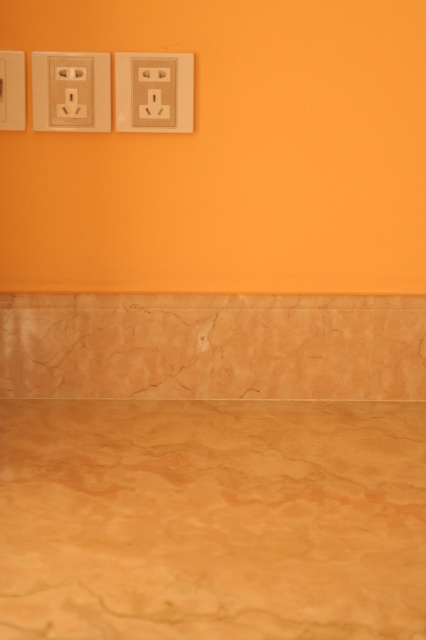
Is beige plastic outlet at upper center bigger than matte beige outlet at upper left?

Yes.

Which is below, beige plastic outlet at upper center or matte beige outlet at upper left?

beige plastic outlet at upper center is below.

Is point (143, 120) closer to viewer compared to point (11, 51)?

No, (143, 120) is further to viewer.

Find the location of a particular element. The image size is (426, 640). beige plastic outlet at upper center is located at coordinates tap(154, 92).

The image size is (426, 640). What are the coordinates of `marble countertop at lower center` in the screenshot? It's located at (212, 518).

Does marble countertop at lower center have a greater width compared to beige plastic outlet at upper center?

Yes.

Measure the distance between point (282, 497) and camera.

Point (282, 497) is 1.76 meters from camera.

Where is `marble countertop at lower center`? Image resolution: width=426 pixels, height=640 pixels. marble countertop at lower center is located at coordinates (212, 518).

Does beige plastic outlet at upper left have a smaller size compared to beige plastic outlet at upper center?

No.

Can you confirm if beige plastic outlet at upper left is positioned to the right of beige plastic outlet at upper center?

Incorrect, beige plastic outlet at upper left is not on the right side of beige plastic outlet at upper center.

This screenshot has height=640, width=426. What do you see at coordinates (71, 92) in the screenshot?
I see `beige plastic outlet at upper left` at bounding box center [71, 92].

Locate an element on the screen. The width and height of the screenshot is (426, 640). beige plastic outlet at upper left is located at coordinates [x=71, y=92].